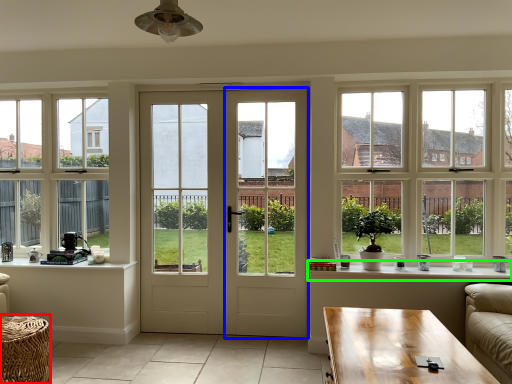
Question: Which is farther away from table (highlighted by a red box)? screen door (highlighted by a blue box) or window sill (highlighted by a green box)?

Choices:
 (A) screen door
 (B) window sill

Answer: (B)